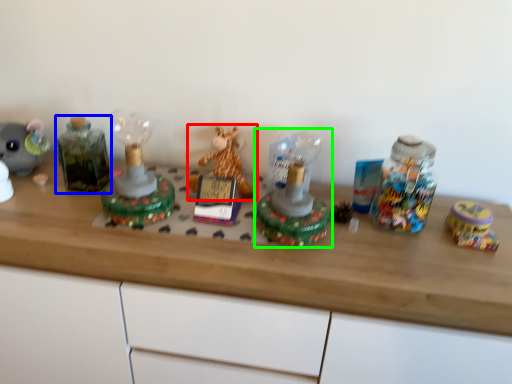
Question: Which object is the closest to the toy (highlighted by a red box)? Choose among these: bottle (highlighted by a blue box) or toy (highlighted by a green box).

Choices:
 (A) bottle
 (B) toy

Answer: (B)